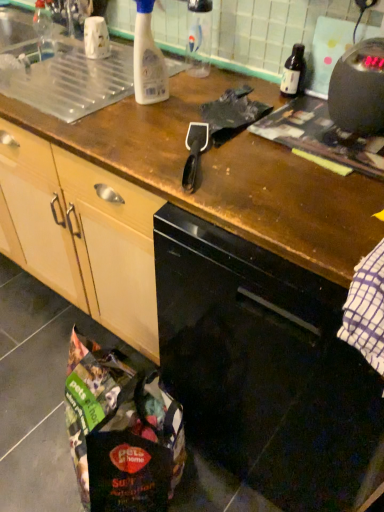
Where is `empty space that is to the right of transparent plastic bottle at upper center, which appears as the second bottle when viewed from the right`? This screenshot has height=512, width=384. empty space that is to the right of transparent plastic bottle at upper center, which appears as the second bottle when viewed from the right is located at coordinates (239, 80).